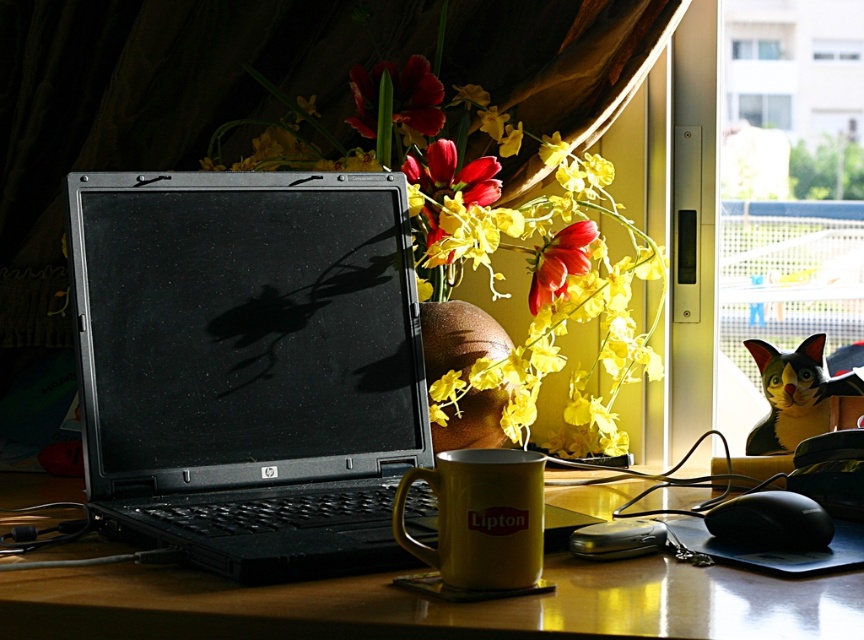
Question: Where is yellow matte mug at center located in relation to matte red flower at center in the image?

Choices:
 (A) left
 (B) right

Answer: (B)

Question: Is black plastic laptop at center bigger than yellow matte mug at center?

Choices:
 (A) no
 (B) yes

Answer: (B)

Question: Observing the image, what is the correct spatial positioning of calico plush cat at right in reference to matte brown vase at center?

Choices:
 (A) below
 (B) above

Answer: (B)

Question: Which point is closer to the camera?

Choices:
 (A) pos(135,620)
 (B) pos(824,372)

Answer: (A)

Question: Estimate the real-world distances between objects in this image. Which object is farther from the wooden table at center?

Choices:
 (A) black plastic laptop at center
 (B) matte plastic vase at center
 (C) transparent glass window at upper right

Answer: (C)

Question: Which object is the farthest from the matte red flower at center?

Choices:
 (A) matte plastic vase at center
 (B) yellow matte mug at center
 (C) calico plush cat at right

Answer: (B)